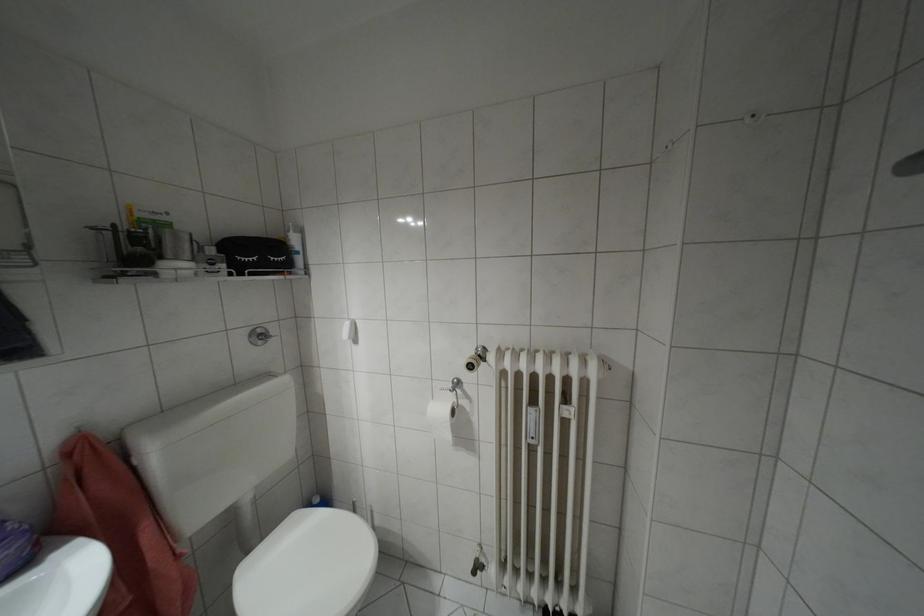
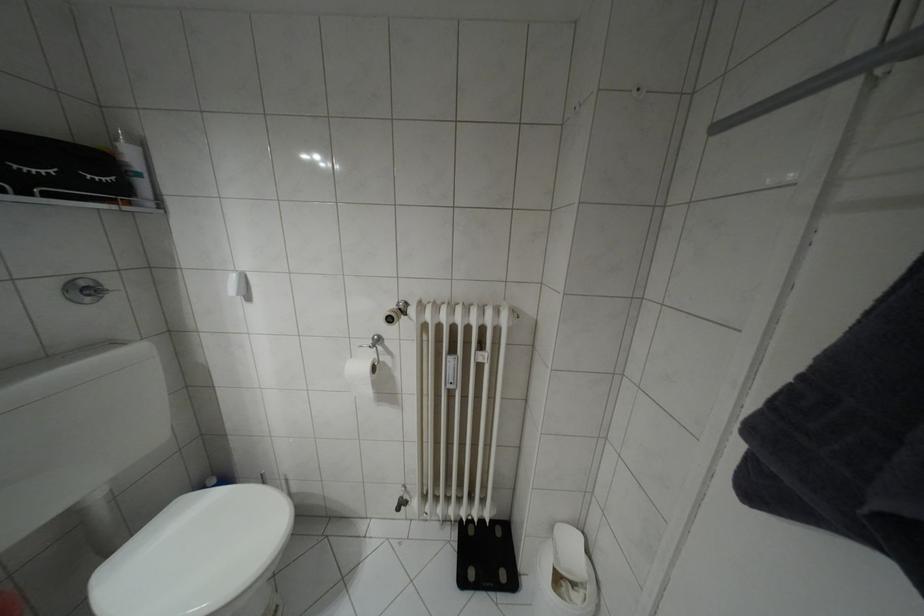
Locate, in the second image, the point that corresponds to [250,274] in the first image.

(49, 195)